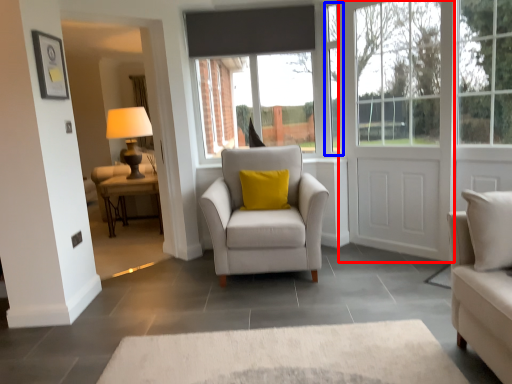
Question: Which object is further to the camera taking this photo, door (highlighted by a red box) or window frame (highlighted by a blue box)?

Choices:
 (A) door
 (B) window frame

Answer: (B)